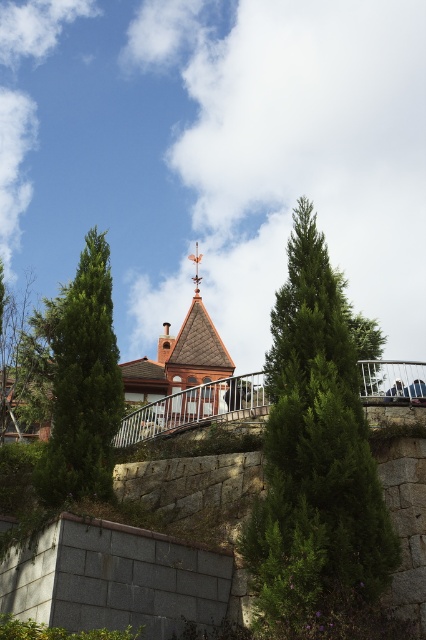
Looking at this image, you are standing in front of the red brick building and notice two trees. Which one, the green textured tree at left or the green leafy tree at upper center, is located to the left of the other?

The green textured tree at left is positioned on the left side of green leafy tree at upper center.

You are standing in front of the red brick building and notice a green textured tree at left and dark blue jeans at center. Which object is closer to you?

The green textured tree at left is closer to you as it is in front of the dark blue jeans at center.

You are standing in front of the red brick building and notice two points marked on the retaining wall. The first point is at coordinate (60,445) and the second is at (393,392). Which point is closer to you?

The point at coordinate (60,445) is closer to the viewer than the point at (393,392).